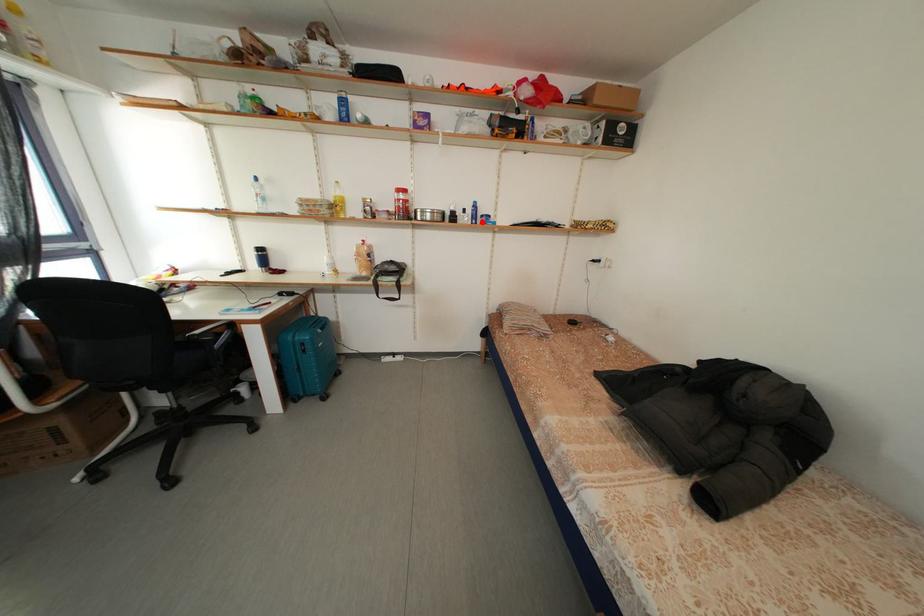
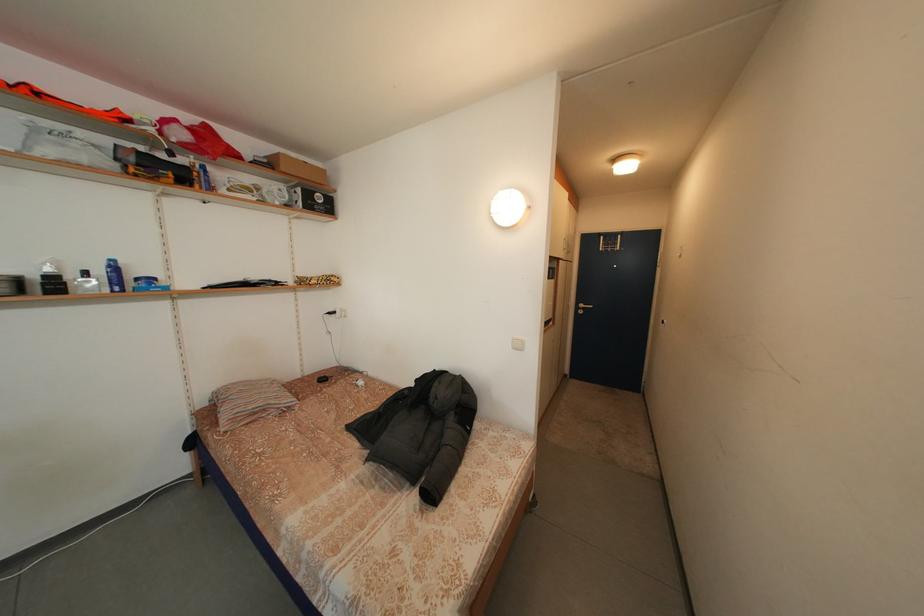
The point at the highlighted location is marked in the first image. Where is the corresponding point in the second image?

(125, 286)